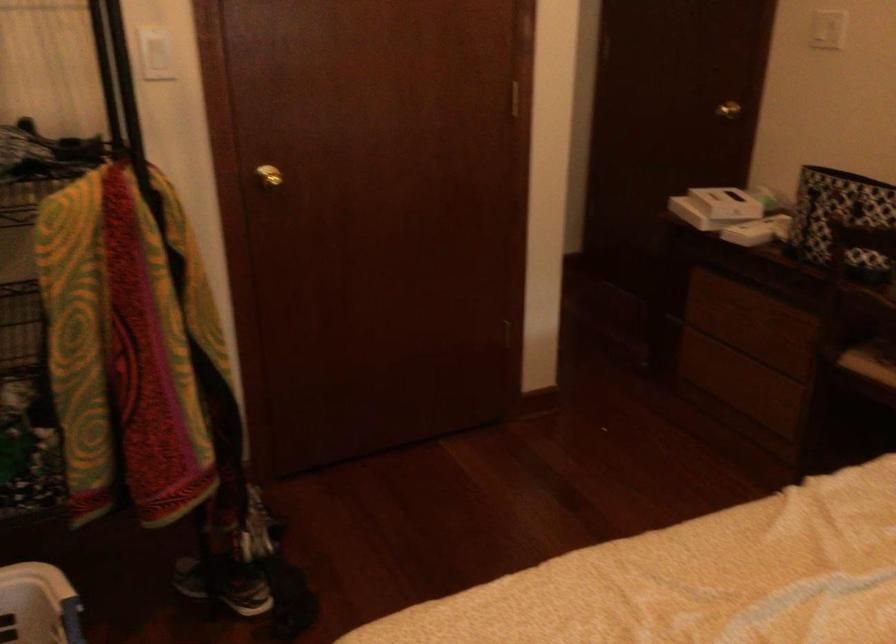
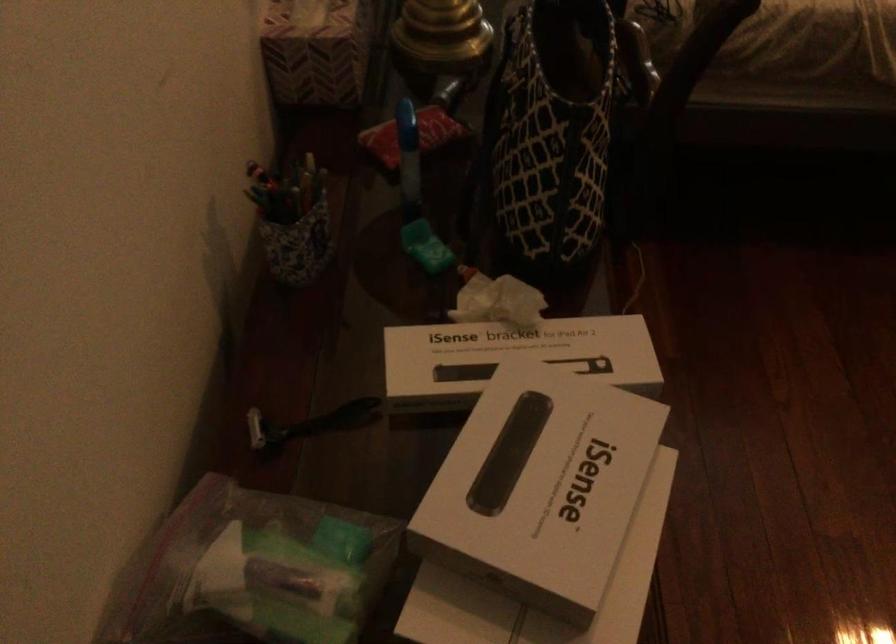
Find the pixel in the second image that matches point (777, 209) in the first image.

(309, 422)